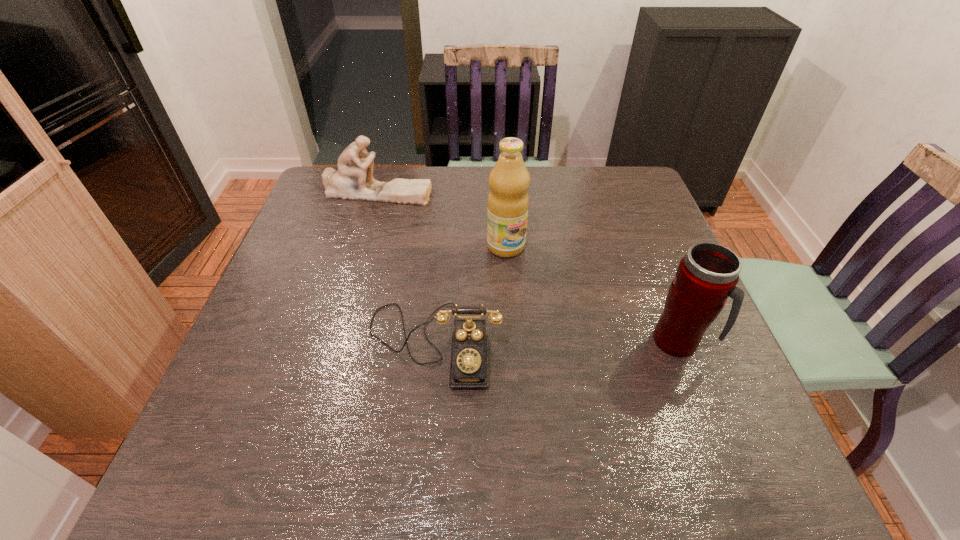
Find the location of a particular element. The height and width of the screenshot is (540, 960). telephone is located at coordinates coord(469,368).

You are a GUI agent. You are given a task and a screenshot of the screen. Output one action in this format:
    pyautogui.click(x=<x>, y=<y>)
    Task: Click on the thermos bottle
    The height and width of the screenshot is (540, 960).
    Given the screenshot: What is the action you would take?
    pyautogui.click(x=707, y=275)

Where is `the rightmost object`? Image resolution: width=960 pixels, height=540 pixels. the rightmost object is located at coordinates (707, 275).

Where is `olive oil`? olive oil is located at coordinates (508, 201).

Locate an element on the screen. The image size is (960, 540). the second farthest object is located at coordinates (508, 201).

Identify the location of the second shortest object. (354, 180).

Locate an element on the screen. The width and height of the screenshot is (960, 540). figurine is located at coordinates (354, 180).

Where is `vacant space located 0.150m on the label of the tallest object`? The height and width of the screenshot is (540, 960). vacant space located 0.150m on the label of the tallest object is located at coordinates (547, 295).

Locate an element on the screen. free location located on the label of the tallest object is located at coordinates (614, 377).

Where is `vacant space positioned 0.220m on the label of the tallest object`? vacant space positioned 0.220m on the label of the tallest object is located at coordinates (564, 316).